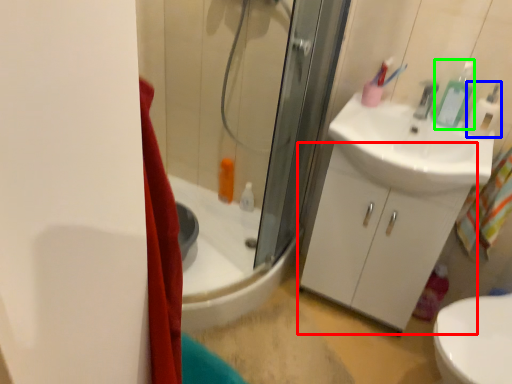
Question: Which object is the farthest from bathroom cabinet (highlighted by a red box)? Choose among these: soap dispenser (highlighted by a blue box) or toiletry (highlighted by a green box).

Choices:
 (A) soap dispenser
 (B) toiletry

Answer: (A)